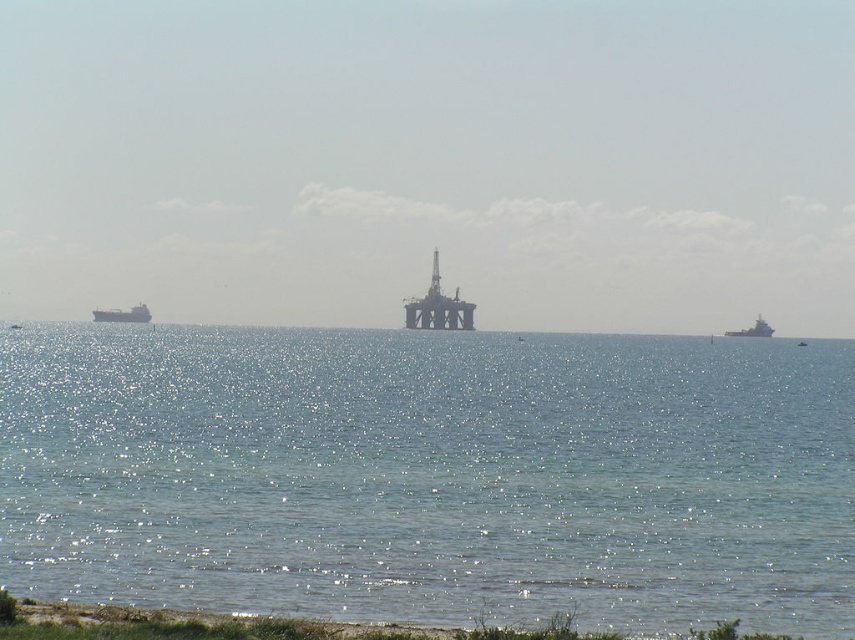
Question: Which object is positioned closest to the clear blue water at center?

Choices:
 (A) metallic gray ship at right
 (B) matte gray cargo ship at left

Answer: (B)

Question: Can you confirm if matte gray cargo ship at left is thinner than metallic gray ship at right?

Choices:
 (A) yes
 (B) no

Answer: (B)

Question: Based on their relative distances, which object is farther from the metallic gray ship at right?

Choices:
 (A) clear blue water at center
 (B) matte gray cargo ship at left

Answer: (A)

Question: Observing the image, what is the correct spatial positioning of matte gray cargo ship at left in reference to metallic gray ship at right?

Choices:
 (A) left
 (B) right

Answer: (A)

Question: Which of the following is the farthest from the observer?

Choices:
 (A) clear blue water at center
 (B) matte gray cargo ship at left
 (C) metallic gray ship at right

Answer: (C)

Question: Is clear blue water at center further to camera compared to matte gray cargo ship at left?

Choices:
 (A) yes
 (B) no

Answer: (B)